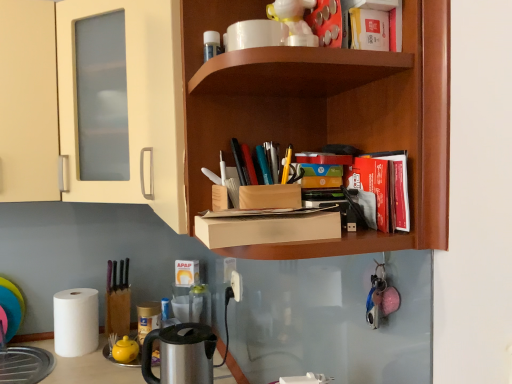
Question: Could you tell me if white matte paper towel at lower left is turned towards white glossy coffee cup at upper center?

Choices:
 (A) no
 (B) yes

Answer: (A)

Question: From the image's perspective, is white matte paper towel at lower left on top of white glossy coffee cup at upper center?

Choices:
 (A) yes
 (B) no

Answer: (B)

Question: Is white matte paper towel at lower left facing away from white glossy coffee cup at upper center?

Choices:
 (A) no
 (B) yes

Answer: (A)

Question: Is white matte paper towel at lower left at the left side of white glossy coffee cup at upper center?

Choices:
 (A) yes
 (B) no

Answer: (A)

Question: Is white matte paper towel at lower left in front of white glossy coffee cup at upper center?

Choices:
 (A) no
 (B) yes

Answer: (A)

Question: Is white glossy toy at upper center spatially inside red matte book at upper right, which is counted as the first book, starting from the bottom, or outside of it?

Choices:
 (A) inside
 (B) outside

Answer: (B)

Question: In terms of size, does white glossy toy at upper center appear bigger or smaller than red matte book at upper right, which is counted as the first book, starting from the bottom?

Choices:
 (A) big
 (B) small

Answer: (A)

Question: Considering the positions of white glossy toy at upper center and red matte book at upper right, which is counted as the first book, starting from the bottom, in the image, is white glossy toy at upper center taller or shorter than red matte book at upper right, which is counted as the first book, starting from the bottom,?

Choices:
 (A) tall
 (B) short

Answer: (A)

Question: From a real-world perspective, is white glossy toy at upper center positioned above or below red matte book at upper right, which is counted as the first book, starting from the bottom?

Choices:
 (A) above
 (B) below

Answer: (A)

Question: Does point pos(237,286) appear closer or farther from the camera than point pos(237,8)?

Choices:
 (A) farther
 (B) closer

Answer: (A)

Question: Looking at the image, does white plastic electric outlet at lower center seem bigger or smaller compared to wooden shelf at upper center?

Choices:
 (A) small
 (B) big

Answer: (A)

Question: Is white plastic electric outlet at lower center inside or outside of wooden shelf at upper center?

Choices:
 (A) outside
 (B) inside

Answer: (A)

Question: In terms of width, does white plastic electric outlet at lower center look wider or thinner when compared to wooden shelf at upper center?

Choices:
 (A) thin
 (B) wide

Answer: (A)

Question: From the image's perspective, is wooden shelf at upper center positioned above or below red matte book at upper right, placed as the 2th book when sorted from bottom to top?

Choices:
 (A) above
 (B) below

Answer: (A)

Question: Considering the positions of wooden shelf at upper center and red matte book at upper right, placed as the 2th book when sorted from bottom to top, in the image, is wooden shelf at upper center taller or shorter than red matte book at upper right, placed as the 2th book when sorted from bottom to top,?

Choices:
 (A) short
 (B) tall

Answer: (B)